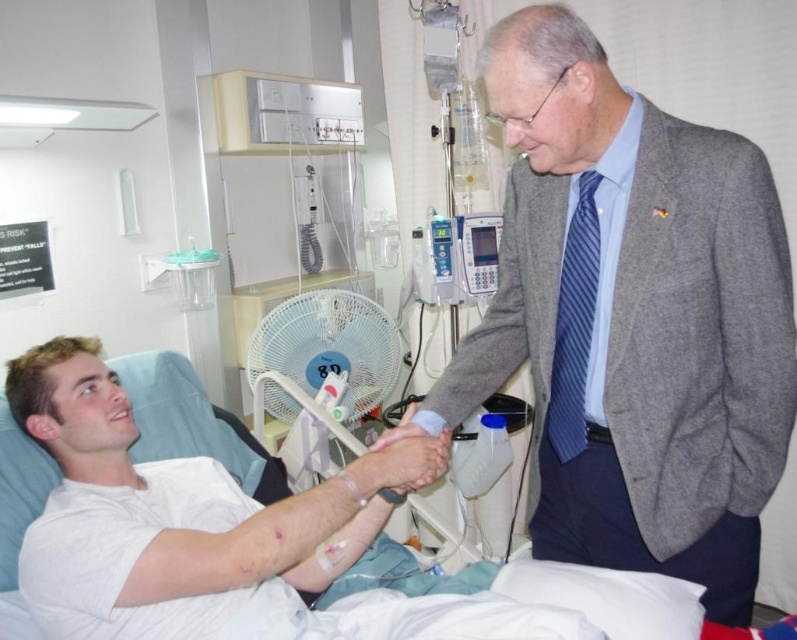
Question: Which point is closer to the camera?

Choices:
 (A) white fabric hospital bed at center
 (B) smooth skin hand at center

Answer: (A)

Question: Which point is closer to the camera taking this photo?

Choices:
 (A) (603, 289)
 (B) (29, 588)
 (C) (395, 490)

Answer: (A)

Question: Is white fabric hospital bed at center above smooth skin hand at center?

Choices:
 (A) yes
 (B) no

Answer: (B)

Question: Is gray woolen suit at center above white fabric hospital bed at center?

Choices:
 (A) no
 (B) yes

Answer: (B)

Question: Based on their relative distances, which object is farther from the smooth skin hand at center?

Choices:
 (A) white fabric hospital bed at center
 (B) gray woolen suit at center

Answer: (B)

Question: Does gray woolen suit at center come behind white fabric hospital bed at center?

Choices:
 (A) no
 (B) yes

Answer: (B)